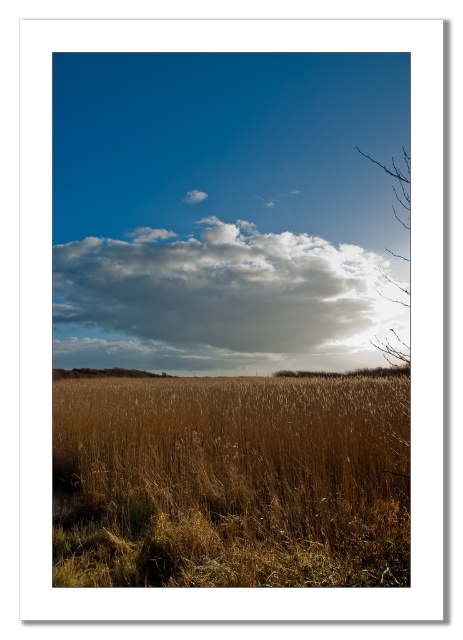
Who is taller, brown grassy field at center or brown textured tree at lower right?

brown grassy field at center is taller.

Identify the location of brown grassy field at center. Image resolution: width=463 pixels, height=640 pixels. (231, 481).

Can you confirm if cloudy white cloud at upper center is positioned below brown textured tree at lower right?

Incorrect, cloudy white cloud at upper center is not positioned below brown textured tree at lower right.

Which is more to the right, cloudy white cloud at upper center or brown textured tree at lower right?

brown textured tree at lower right

Is point (58, 307) in front of point (382, 376)?

That is False.

Identify the location of cloudy white cloud at upper center. (217, 300).

Does point (386, 172) come in front of point (387, 369)?

No, (386, 172) is behind (387, 369).

Is point (406, 220) positioned in front of point (381, 368)?

No, (406, 220) is further to viewer.

Find the location of a particular element. The width and height of the screenshot is (463, 640). bare branches at upper right is located at coordinates (398, 184).